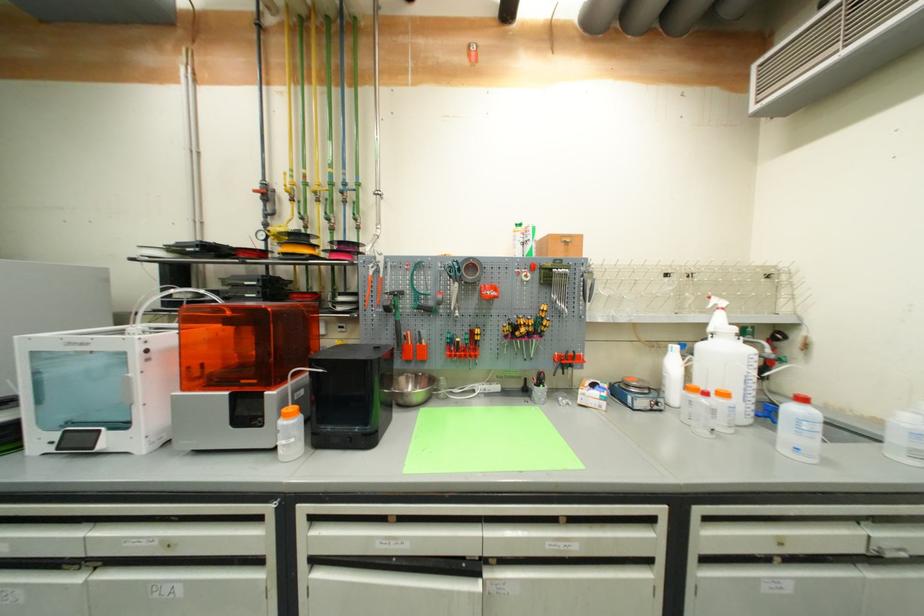
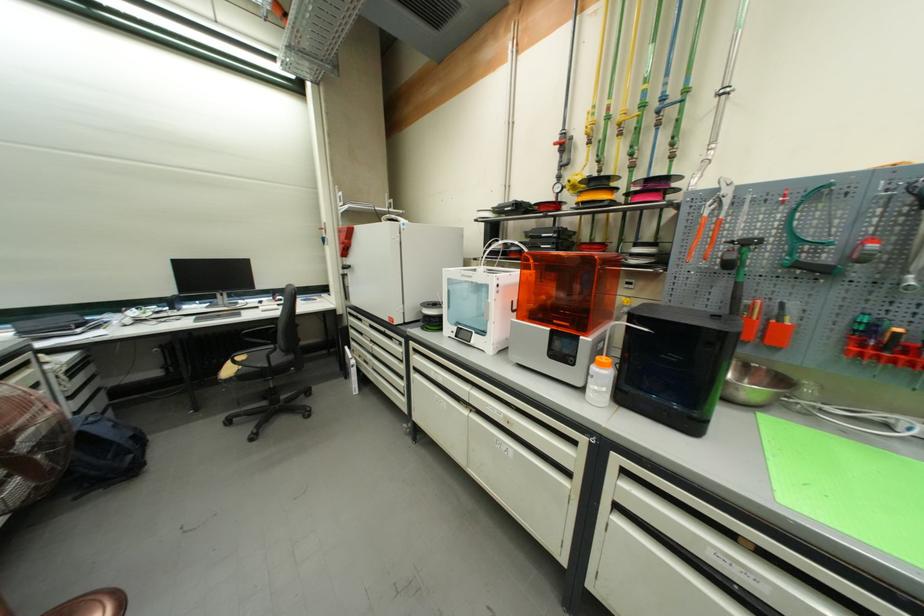
Question: How did the camera likely rotate?

Choices:
 (A) Left
 (B) Right
 (C) Up
 (D) Down

Answer: (A)